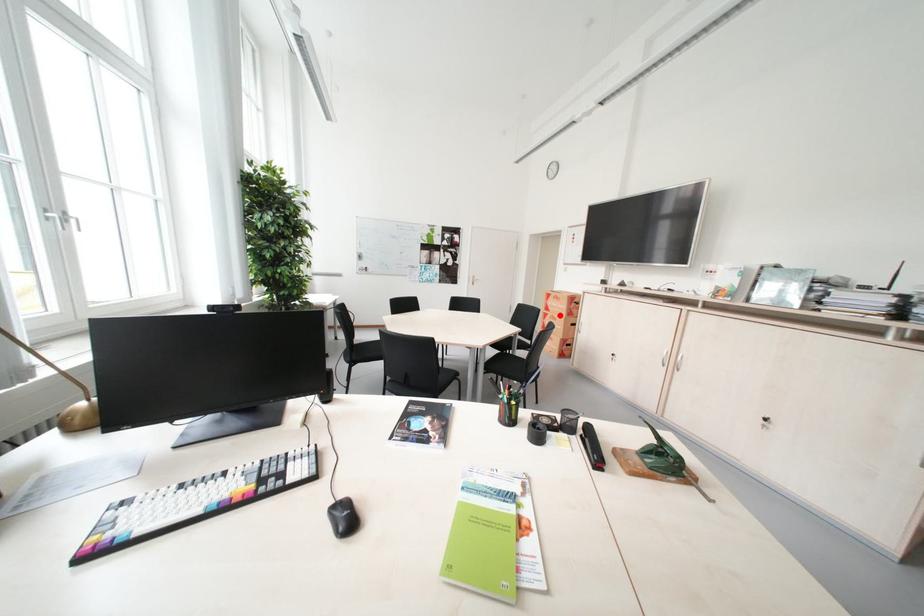
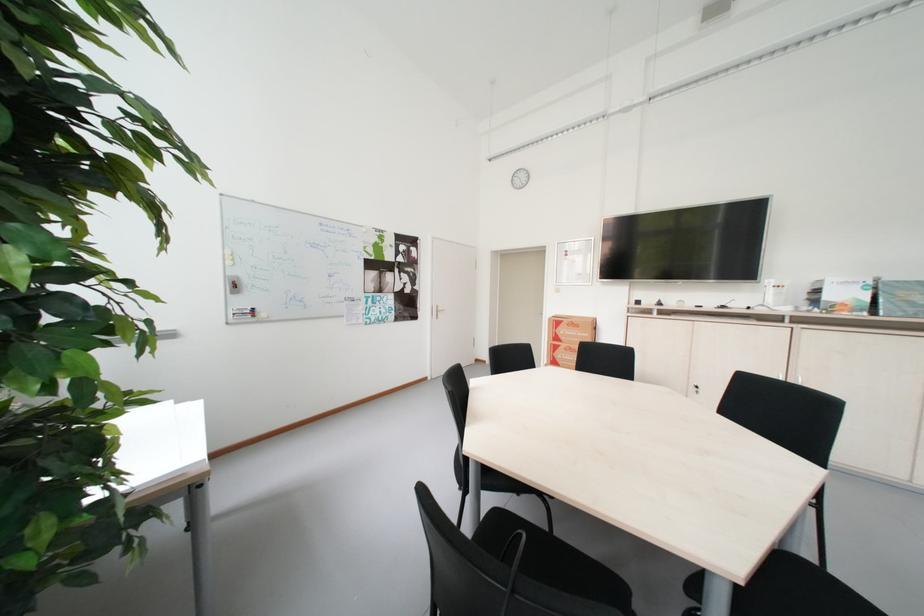
Question: I am providing you with two images of the same scene from different viewpoints. A red point is shown in image1. For the corresponding object point in image2, is it positioned nearer or farther from the camera?

Choices:
 (A) Nearer
 (B) Farther

Answer: (A)